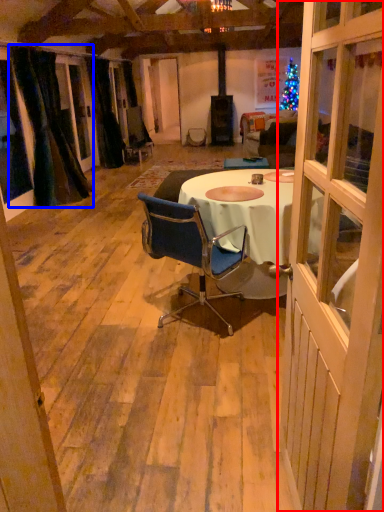
Question: Which object is further to the camera taking this photo, door (highlighted by a red box) or curtain (highlighted by a blue box)?

Choices:
 (A) door
 (B) curtain

Answer: (B)